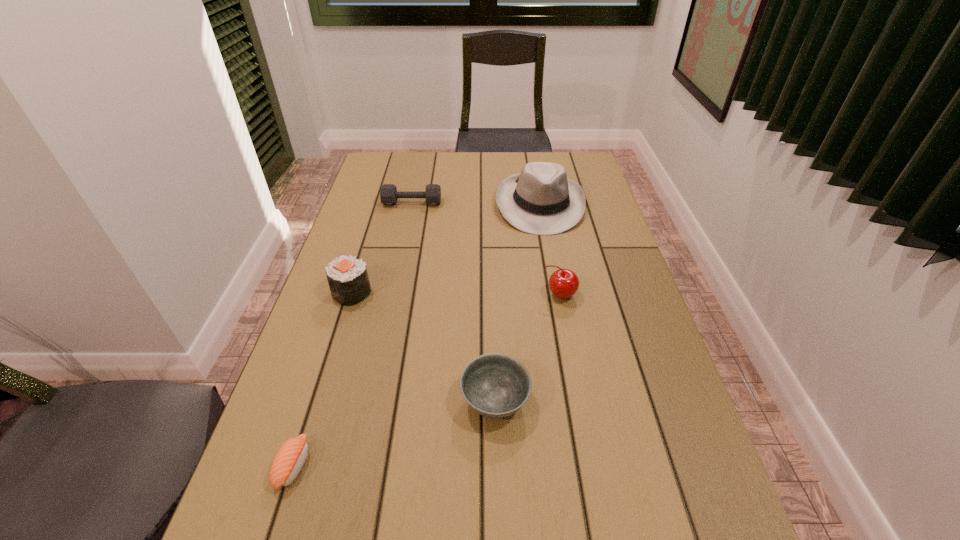
The height and width of the screenshot is (540, 960). I want to click on vacant space at the far left corner, so click(396, 167).

This screenshot has width=960, height=540. In order to click on free space that is in between the shortest object and the fedora in this screenshot , I will do `click(417, 334)`.

This screenshot has height=540, width=960. In order to click on vacant point located between the nearer sushi and the fedora in this screenshot , I will do `click(417, 334)`.

The image size is (960, 540). What are the coordinates of `vacant region between the taller sushi and the second nearest object` in the screenshot? It's located at (423, 347).

The image size is (960, 540). In order to click on free space between the cherry and the dumbbell in this screenshot , I will do `click(486, 249)`.

This screenshot has width=960, height=540. Identify the location of free space between the tallest object and the bowl. (517, 302).

I want to click on free area in between the dumbbell and the fedora, so click(476, 204).

At what (x,y) coordinates should I click in order to perform the action: click on vacant space that's between the tallest object and the taller sushi. Please return your answer as a coordinate pair (x, y). The height and width of the screenshot is (540, 960). Looking at the image, I should click on (445, 248).

Locate an element on the screen. Image resolution: width=960 pixels, height=540 pixels. free spot between the dumbbell and the nearer sushi is located at coordinates (353, 334).

Where is `free space between the cherry and the shortest object`? free space between the cherry and the shortest object is located at coordinates (426, 380).